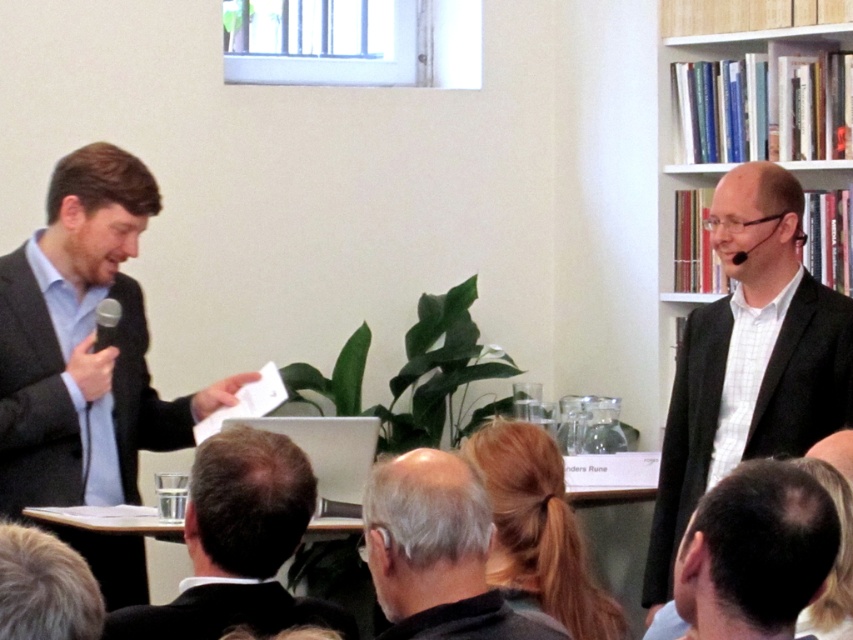
Question: Among these objects, which one is nearest to the camera?

Choices:
 (A) black matte suit at lower center
 (B) dark brown hair at lower right
 (C) white glossy bookshelf at upper right
 (D) dark brown hair at lower center

Answer: (B)

Question: Can you confirm if matte black suit at left is smaller than matte black suit at upper right?

Choices:
 (A) no
 (B) yes

Answer: (A)

Question: Which is farther from the dark brown hair at lower right?

Choices:
 (A) dark brown hair at lower left
 (B) white glossy bookshelf at upper right
 (C) black matte suit at lower center
 (D) matte black suit at left

Answer: (B)

Question: Which of the following is the farthest from the observer?

Choices:
 (A) matte black suit at upper right
 (B) black matte suit at lower center
 (C) black matte microphone at upper right
 (D) dark brown hair at lower left

Answer: (C)

Question: Can you confirm if matte black suit at left is wider than matte black suit at upper right?

Choices:
 (A) yes
 (B) no

Answer: (A)

Question: Does white glossy bookshelf at upper right appear on the right side of gray hair at lower center?

Choices:
 (A) no
 (B) yes

Answer: (B)